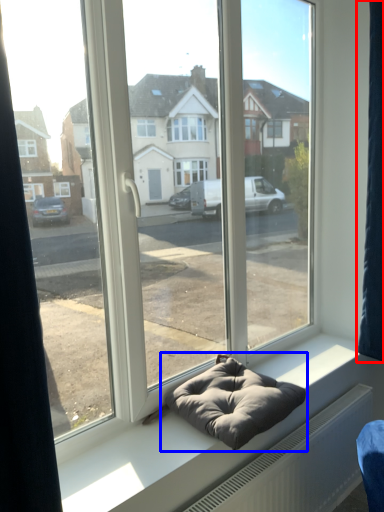
Question: Which of the following is the closest to the observer, curtain (highlighted by a red box) or bean bag chair (highlighted by a blue box)?

Choices:
 (A) curtain
 (B) bean bag chair

Answer: (B)